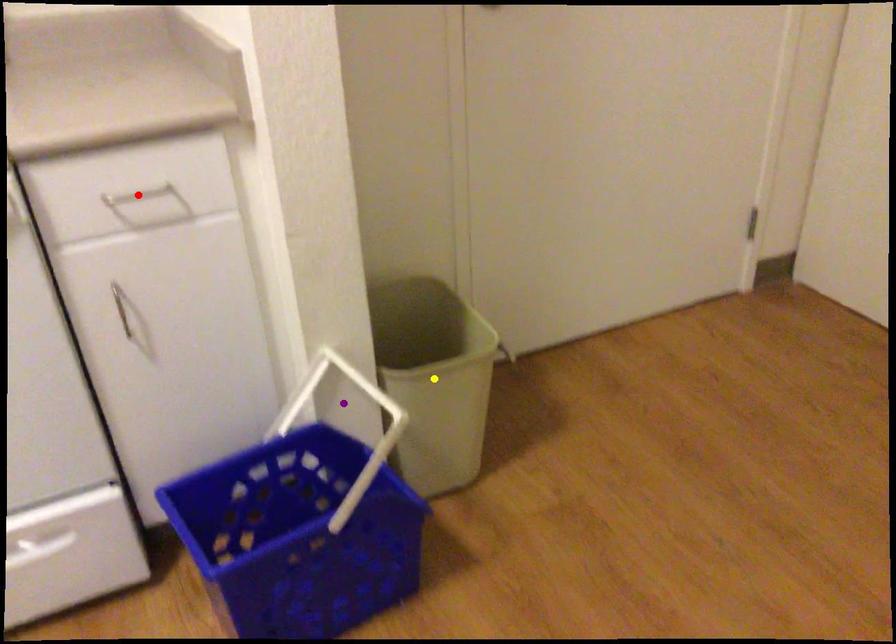
Order these from nearest to farthest:
purple point
red point
yellow point

1. yellow point
2. purple point
3. red point